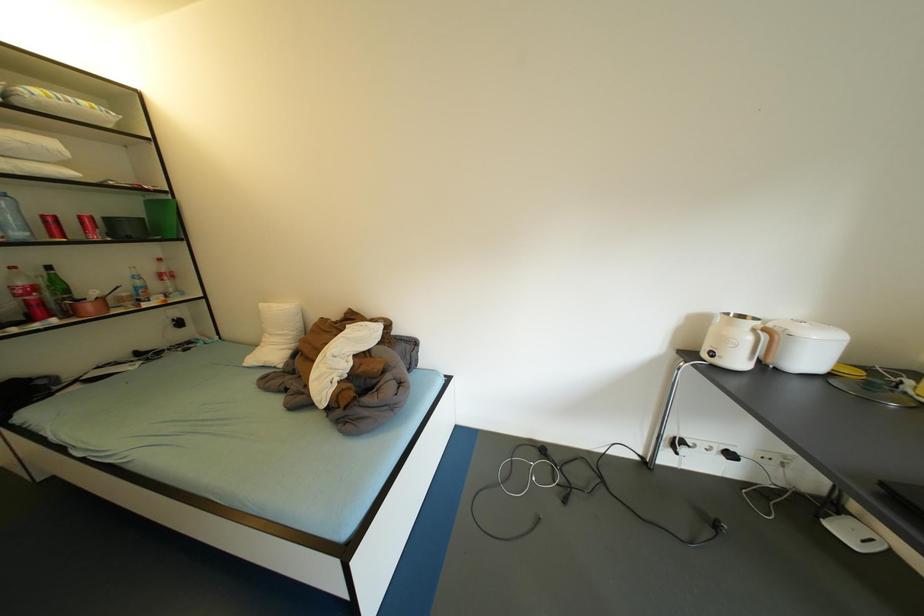
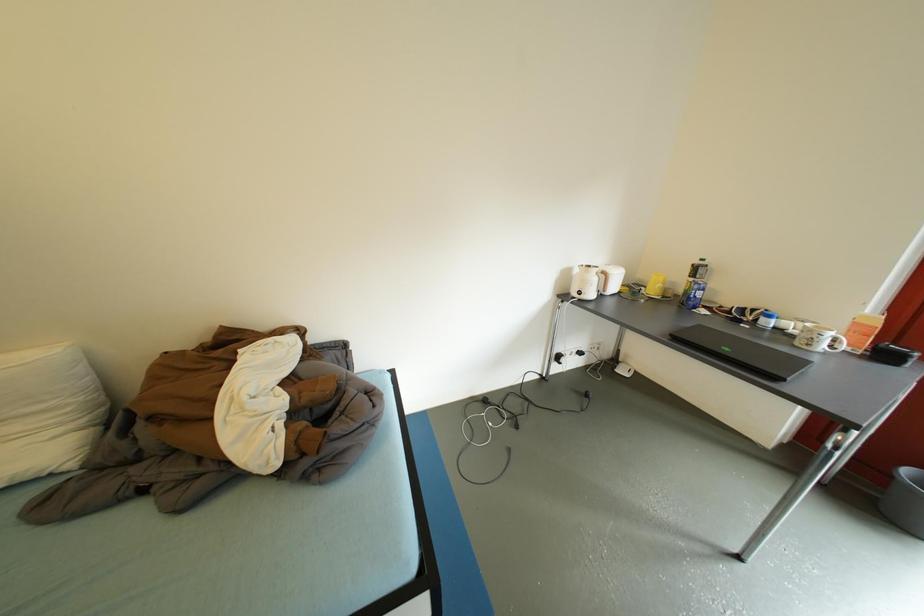
Question: How did the camera likely rotate?

Choices:
 (A) Left
 (B) Right
 (C) Up
 (D) Down

Answer: (B)